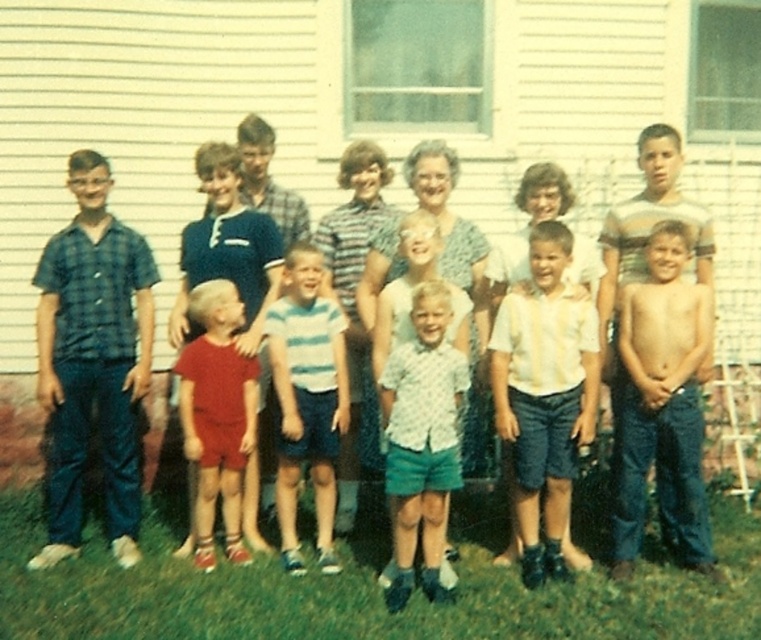
Question: Which point is farther to the camera?

Choices:
 (A) plaid fabric shirt at left
 (B) striped cotton shirt at center
 (C) green grass at lower center
 (D) red cotton shorts at center

Answer: (D)

Question: Which of the following is the farthest from the observer?

Choices:
 (A) (691, 513)
 (B) (69, 381)
 (C) (546, 374)
 (D) (414, 417)

Answer: (B)

Question: Which object is closer to the camera taking this photo?

Choices:
 (A) green grass at lower center
 (B) red cotton shorts at center

Answer: (A)

Question: Can you confirm if white cotton shirt at center is smaller than striped cotton shirt at center?

Choices:
 (A) yes
 (B) no

Answer: (B)

Question: Does white cotton shirt at center appear on the left side of light blue denim shorts at center?

Choices:
 (A) no
 (B) yes

Answer: (A)

Question: Does plaid fabric shirt at left have a greater width compared to light blue denim shorts at center?

Choices:
 (A) yes
 (B) no

Answer: (A)